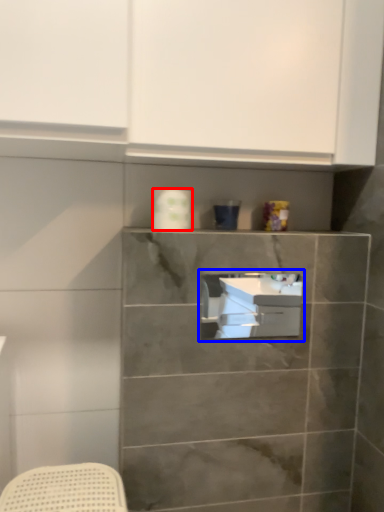
Question: Which object is further to the camera taking this photo, toilet paper (highlighted by a red box) or sink (highlighted by a blue box)?

Choices:
 (A) toilet paper
 (B) sink

Answer: (A)